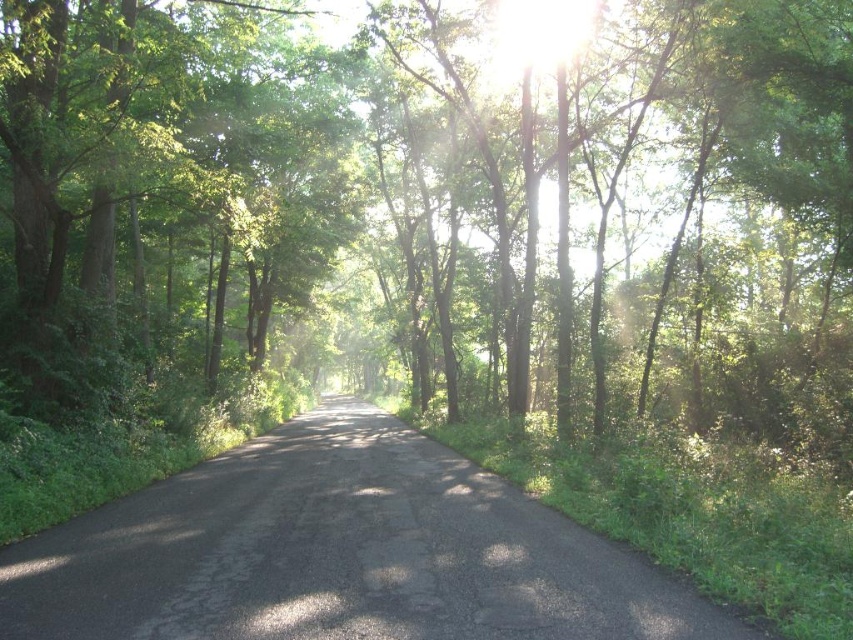
You are a hiker standing at the start of the forest path and see the black asphalt road at center and the green leafy tree at left. Which object appears smaller in the image?

The black asphalt road at center appears smaller than the green leafy tree at left in the image.

You are standing at point (440, 204) on the forest road. Looking around, you see a green leafy tree at center. Which direction should you walk to move away from the green leafy tree at center?

Since you are standing at point (440, 204) where the green leafy tree at center is located, you should walk in any direction except towards the tree to move away from it. However, based on the scene description, the road stretches into the distance flanked by dense greenery. To stay on the road and move away from the tree, walking forward along the road away from the tree would be appropriate.

You are standing on the forest road and want to reach a hidden treasure located at point (271, 625). There is an obstacle at point (397, 161). Will you encounter the obstacle before reaching the treasure?

Point (397, 161) is behind point (271, 625), so you will reach the treasure at point (271, 625) before encountering the obstacle at point (397, 161). Therefore, you will not encounter the obstacle before reaching the treasure.